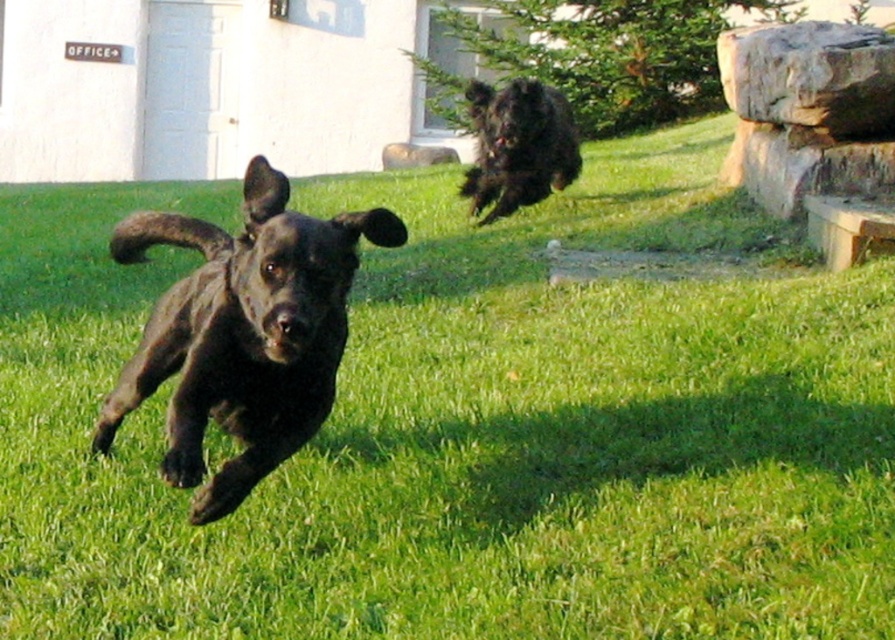
You are a photographer trying to capture the shiny black dog at center and the shaggy black dog at upper right in a single frame. Given their sizes, which dog would appear bigger in your photo?

The shiny black dog at center would appear bigger in the photo because it has a larger size compared to the shaggy black dog at upper right.

You are a photographer trying to capture both the shiny black dog at center and the shaggy black dog at upper right in a single frame. Given that your camera has a focal length of 50mm and the dogs are 14.51 feet apart, what is the minimum distance you need to stand from the dogs to ensure both are fully in the frame?

The minimum distance you need to stand from the dogs is approximately 14.51 feet divided by the camera sensor width in feet. However, without knowing the sensor size, a general rule is to position yourself at least half the distance between the subjects, so standing about 7.25 feet away might work, but this depends on lens and sensor specifications.